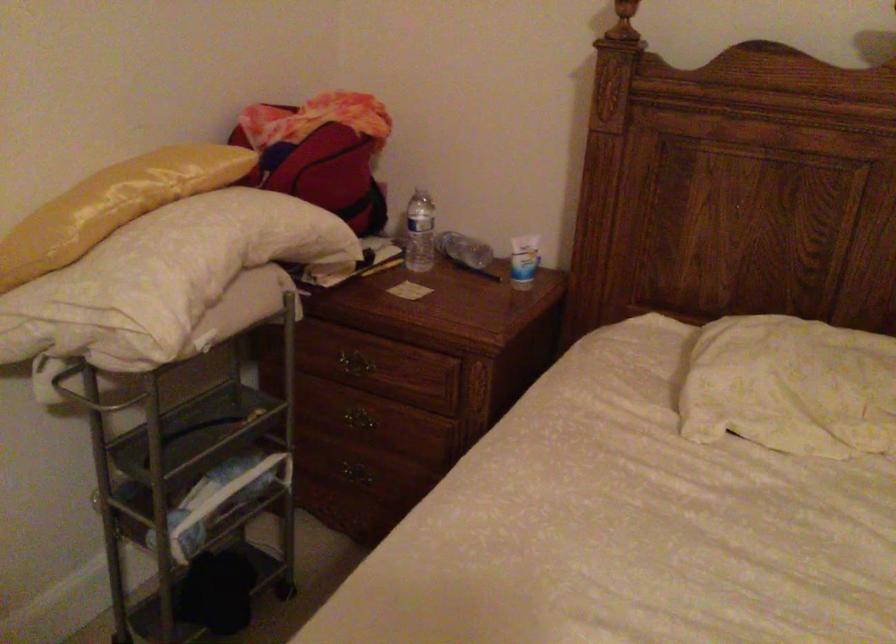
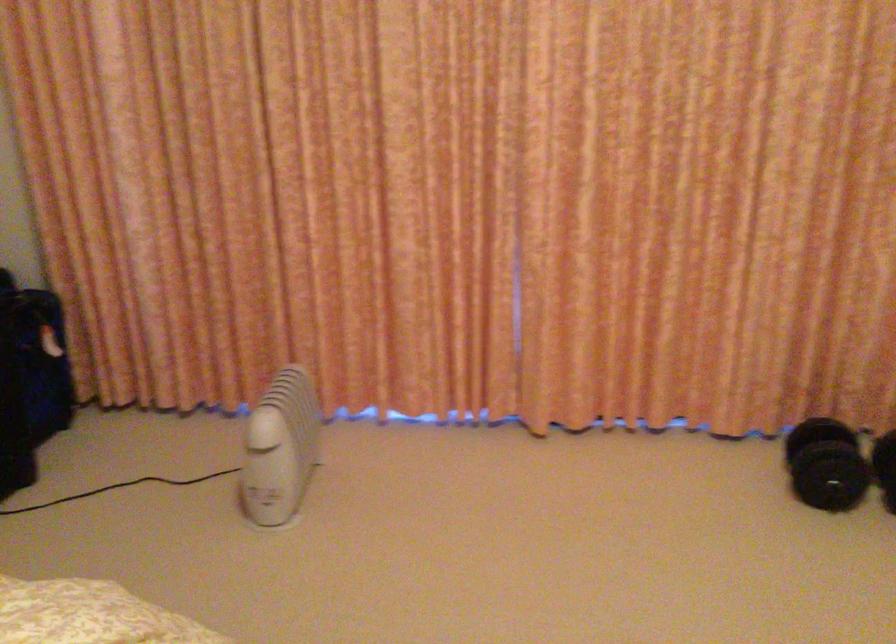
First-person continuous shooting, in which direction is the camera rotating?

The camera's rotation is toward right-down.